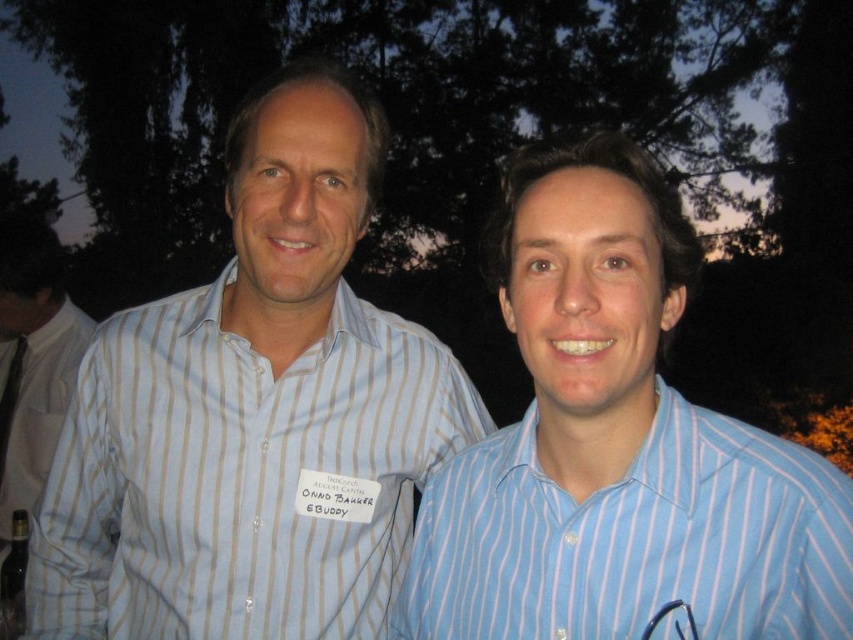
You are a photographer standing 2 meters away from the two people in the image. You want to take a group photo of them. Given that your camera has a maximum focus range of 1.8 meters, will you be able to capture both the blue striped shirt at center and the white striped shirt at left clearly in the photo?

The blue striped shirt at center and white striped shirt at left are 1.74 meters apart. Since the photographer is standing 2 meters away from them, the distance between the subjects is within the camera maximum focus range of 1.8 meters. Therefore, both subjects will be in focus and clearly captured in the photo.

Where is the light blue striped shirt at center located in the image?

The light blue striped shirt at center is located at point [253,413] in the image.